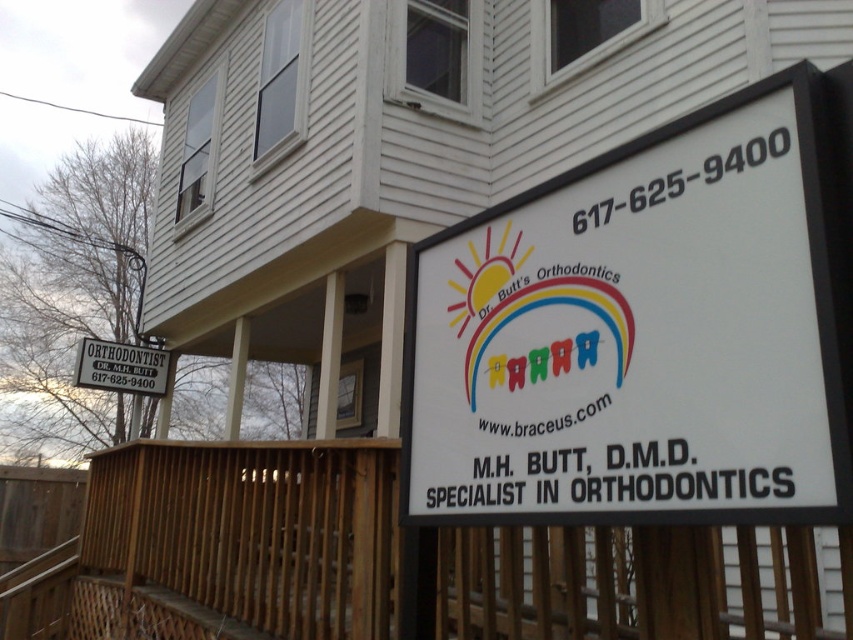
Question: Does wooden at lower center lie in front of white plastic sign at upper left?

Choices:
 (A) no
 (B) yes

Answer: (B)

Question: Can you confirm if white plastic sign at right is smaller than wooden at lower center?

Choices:
 (A) no
 (B) yes

Answer: (B)

Question: Does white plastic sign at right have a smaller size compared to white plastic sign at upper left?

Choices:
 (A) no
 (B) yes

Answer: (A)

Question: Among these points, which one is farthest from the camera?

Choices:
 (A) (523, 499)
 (B) (144, 349)
 (C) (758, 588)

Answer: (B)

Question: Which point is farther from the camera taking this photo?

Choices:
 (A) (126, 362)
 (B) (706, 561)

Answer: (A)

Question: Which object is the closest to the white plastic sign at right?

Choices:
 (A) wooden at lower center
 (B) white plastic sign at upper left

Answer: (A)